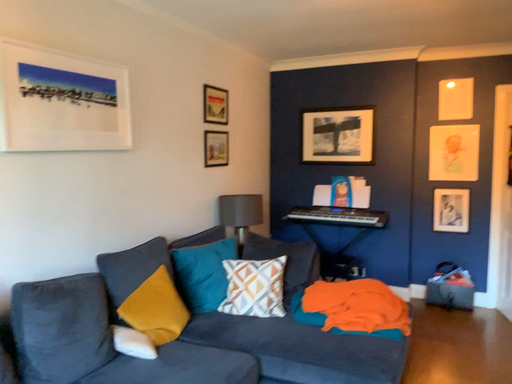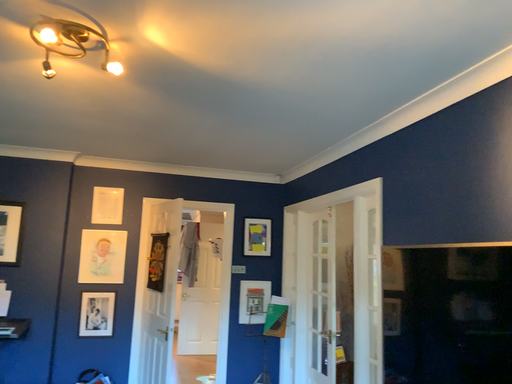
Question: Which way did the camera rotate in the video?

Choices:
 (A) rotated downward
 (B) rotated upward

Answer: (B)